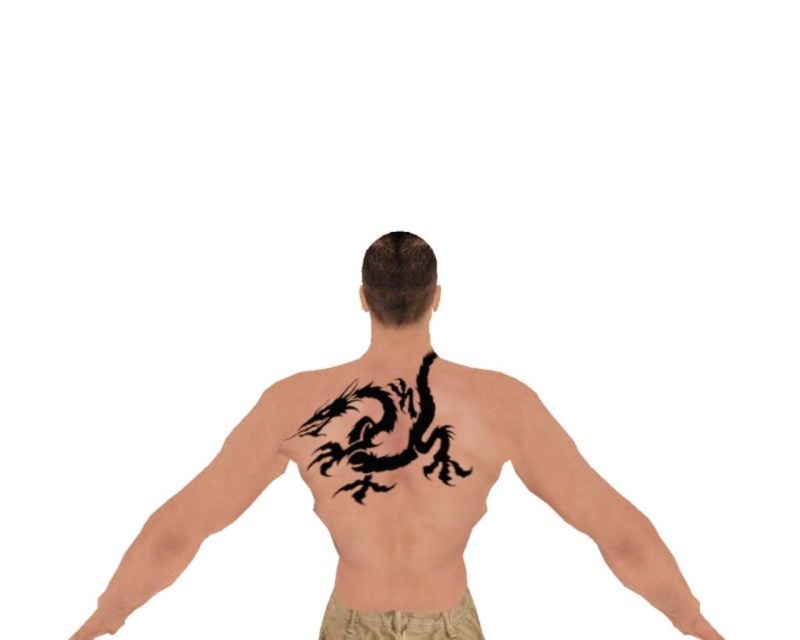
Question: Can you confirm if smooth skin at right is positioned above tan fabric shorts at lower center?

Choices:
 (A) no
 (B) yes

Answer: (B)

Question: Which point is closer to the camera?

Choices:
 (A) tan fabric shorts at lower center
 (B) smooth skin at right
 (C) black ink tattoo at upper left
 (D) black ink dragon at center

Answer: (D)

Question: Is smooth skin at right further to camera compared to tan fabric shorts at lower center?

Choices:
 (A) yes
 (B) no

Answer: (B)

Question: Estimate the real-world distances between objects in this image. Which object is closer to the smooth skin at right?

Choices:
 (A) black ink tattoo at upper left
 (B) black ink dragon tattoo at center
 (C) black ink dragon at center
 (D) tan fabric shorts at lower center

Answer: (B)

Question: Estimate the real-world distances between objects in this image. Which object is closer to the black ink dragon at center?

Choices:
 (A) black ink tattoo at upper left
 (B) black ink dragon tattoo at center

Answer: (B)

Question: Is black ink dragon at center thinner than tan fabric shorts at lower center?

Choices:
 (A) no
 (B) yes

Answer: (B)